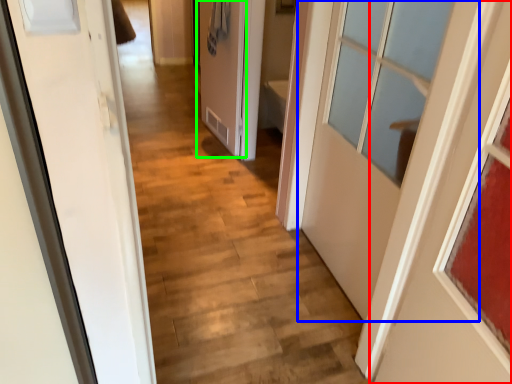
Question: Which is nearer to the door (highlighted by a red box)? door (highlighted by a blue box) or door (highlighted by a green box).

Choices:
 (A) door
 (B) door

Answer: (A)